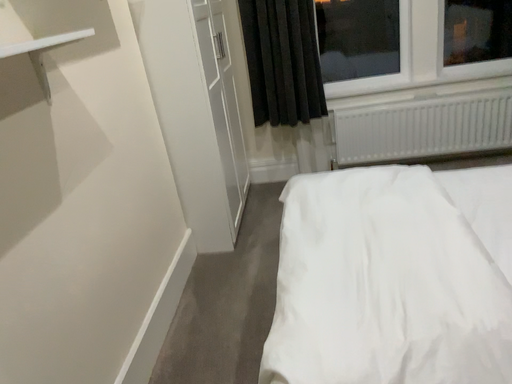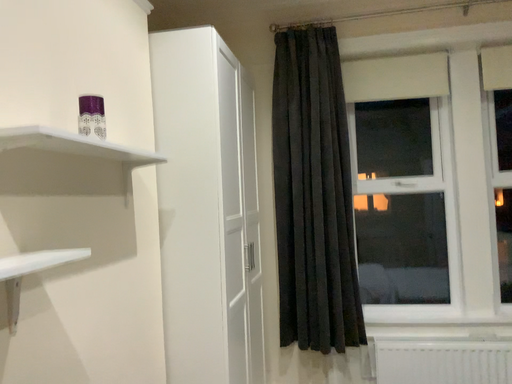
Question: Which way did the camera rotate in the video?

Choices:
 (A) rotated downward
 (B) rotated upward

Answer: (B)